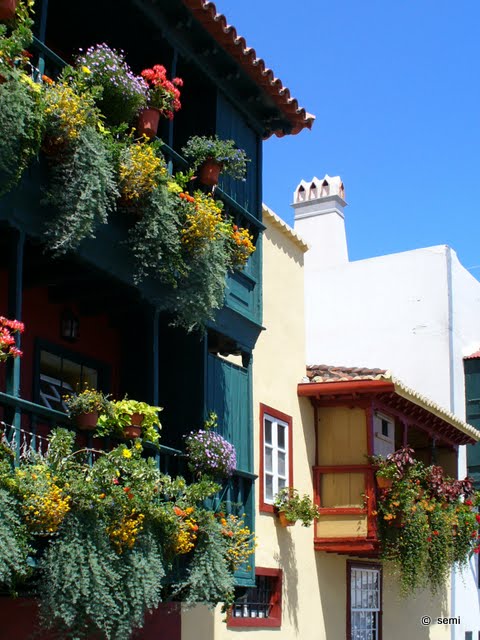
In order to click on light in this screenshot , I will do `click(71, 324)`.